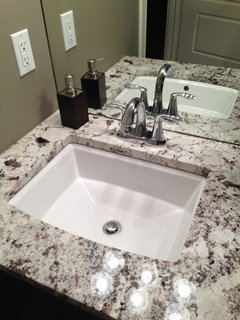
Identify the location of mirror. This screenshot has width=240, height=320. (205, 25).